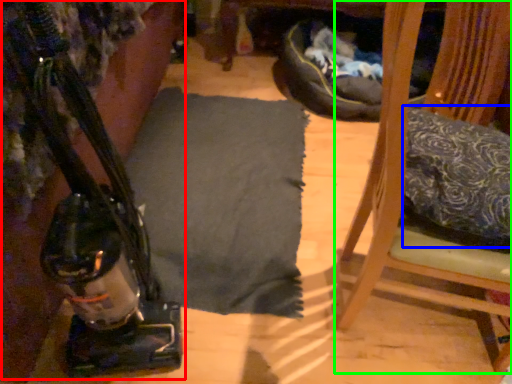
Question: Which object is the farthest from job (highlighted by a red box)? Choose among these: pillow (highlighted by a blue box) or furniture (highlighted by a green box).

Choices:
 (A) pillow
 (B) furniture

Answer: (A)